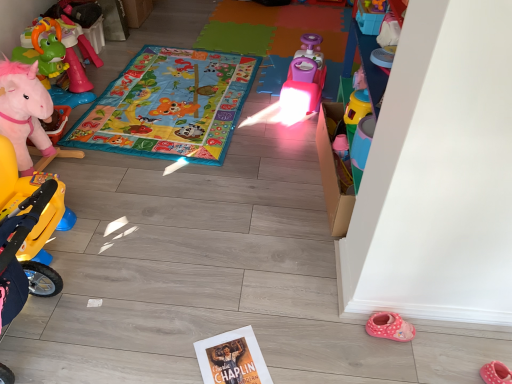
Question: In terms of width, does translucent plastic cup at center-right, marked as the third toy in a left-to-right arrangement, look wider or thinner when compared to multicolored fabric play mat at center?

Choices:
 (A) thin
 (B) wide

Answer: (A)

Question: Relative to multicolored fabric play mat at center, is translucent plastic cup at center-right, which appears as the first toy when viewed from the right, in front or behind?

Choices:
 (A) front
 (B) behind

Answer: (A)

Question: Which object is positioned farthest from the pink plastic toy car at center, positioned as the 2th toy in left-to-right order?

Choices:
 (A) pink fabric slipper at lower right
 (B) multicolored fabric play mat at center
 (C) pink plush unicorn at left, the 1th toy viewed from the back
 (D) translucent plastic cup at center-right, marked as the third toy in a left-to-right arrangement

Answer: (A)

Question: Estimate the real-world distances between objects in this image. Which object is closer to the pink plush unicorn at left, the 1th toy viewed from the back?

Choices:
 (A) multicolored fabric play mat at center
 (B) pink fabric slipper at lower right
 (C) pink plastic toy car at center, the 2th toy in the back-to-front sequence
 (D) translucent plastic cup at center-right, which is the 1th toy in front-to-back order

Answer: (A)